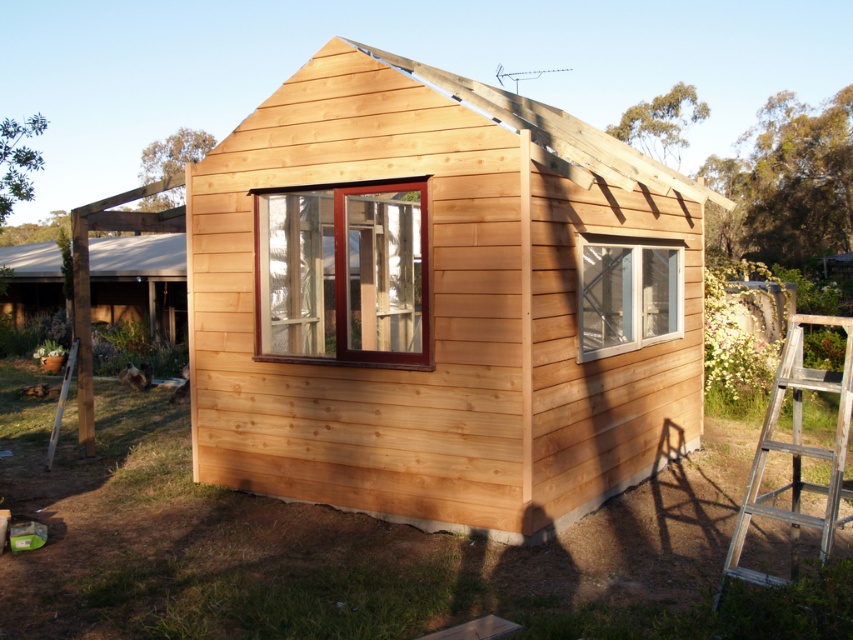
Question: Is natural wood cabin at center to the right of clear glass window at center from the viewer's perspective?

Choices:
 (A) no
 (B) yes

Answer: (B)

Question: Among these points, which one is nearest to the camera?

Choices:
 (A) click(x=297, y=324)
 (B) click(x=795, y=557)

Answer: (B)

Question: Can you confirm if silver metallic ladder at lower right is wider than clear glass window at center?

Choices:
 (A) yes
 (B) no

Answer: (B)

Question: Which of the following is the closest to the observer?

Choices:
 (A) silver metallic ladder at lower right
 (B) brown wooden window at center
 (C) white smooth roof at upper left

Answer: (A)

Question: Does brown wooden window at center have a larger size compared to white smooth roof at upper left?

Choices:
 (A) yes
 (B) no

Answer: (B)

Question: Among these objects, which one is farthest from the camera?

Choices:
 (A) natural wood cabin at center
 (B) clear glass window at center
 (C) brown wooden window at center
 (D) silver metallic ladder at lower right

Answer: (A)